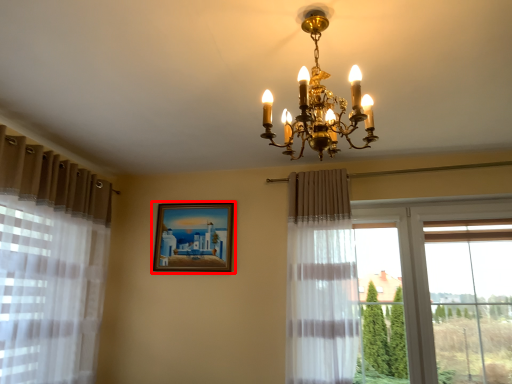
Question: Observing the image, what is the correct spatial positioning of picture frame (annotated by the red box) in reference to lamp?

Choices:
 (A) right
 (B) left

Answer: (B)